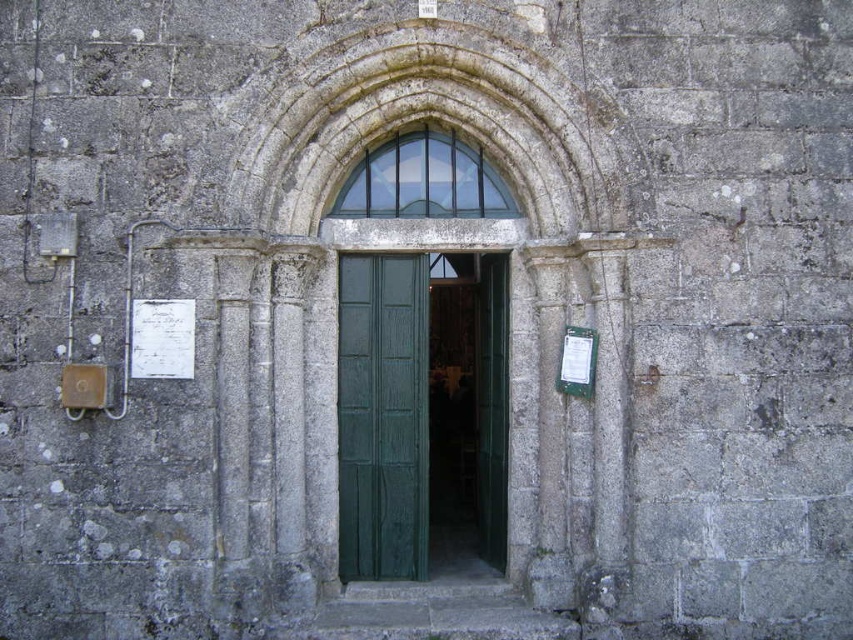
From the picture: You are standing at the entrance of the historic stone building. There are two points marked on the ground in front of you. The first point is at coordinates point (374, 188) and the second point is at point (135, 358). If you were to walk from the first point to the second point, would you be moving towards the building or away from it?

Since point (374, 188) is behind point (135, 358), moving from the first point to the second point would mean moving away from the building.

You are a visitor at the entrance of the historic building. You notice the clear glass window at center and the white paper sign at upper left. Which object is taller?

The clear glass window at center is much taller than the white paper sign at upper left.